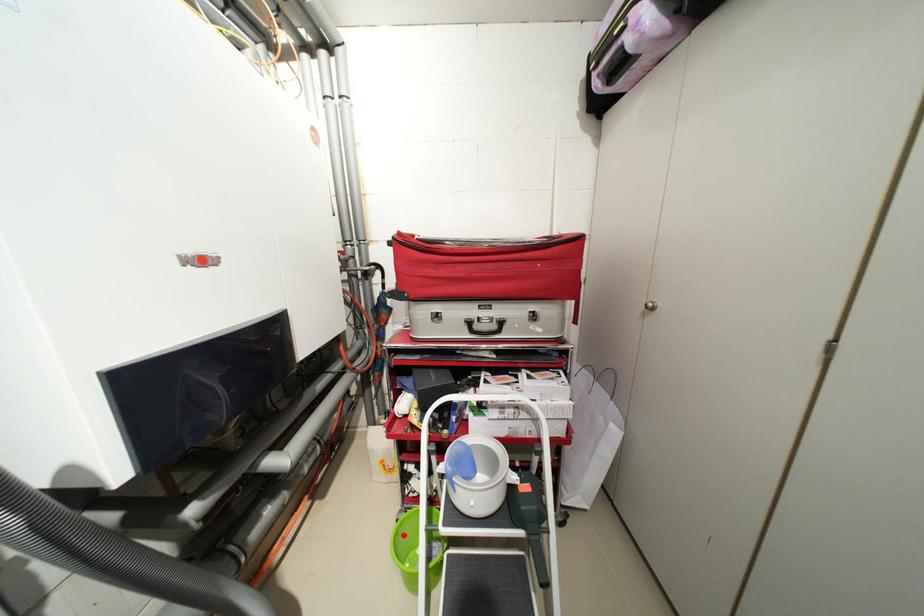
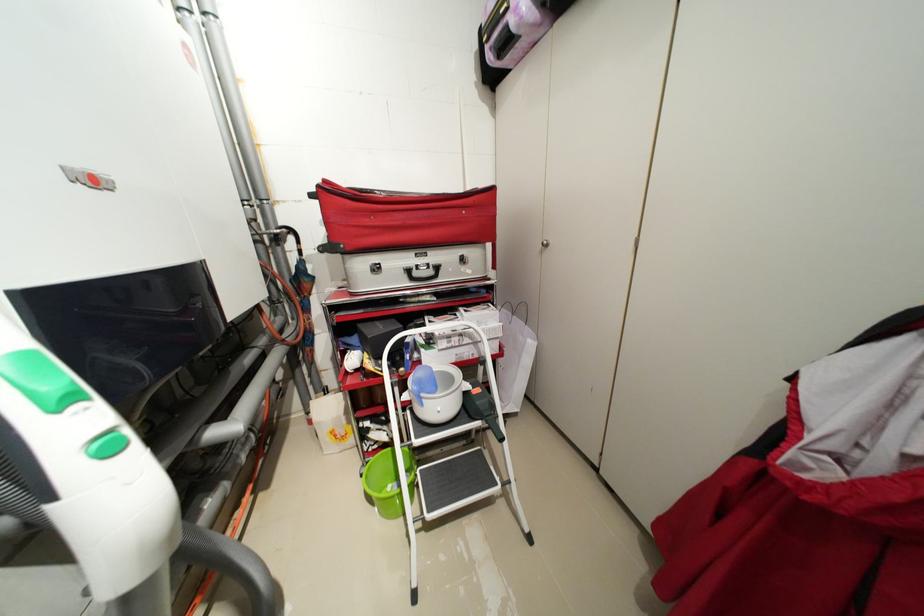
Question: I am providing you with two images of the same scene from different viewpoints. A red point is marked on the first image. Is the red point's position out of view in image 2?

Choices:
 (A) Yes
 (B) No

Answer: (B)